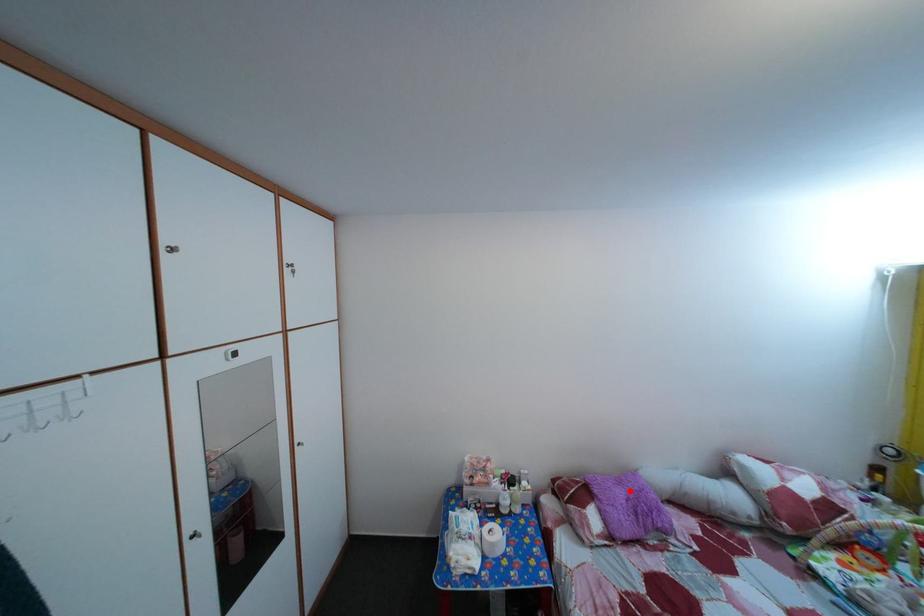
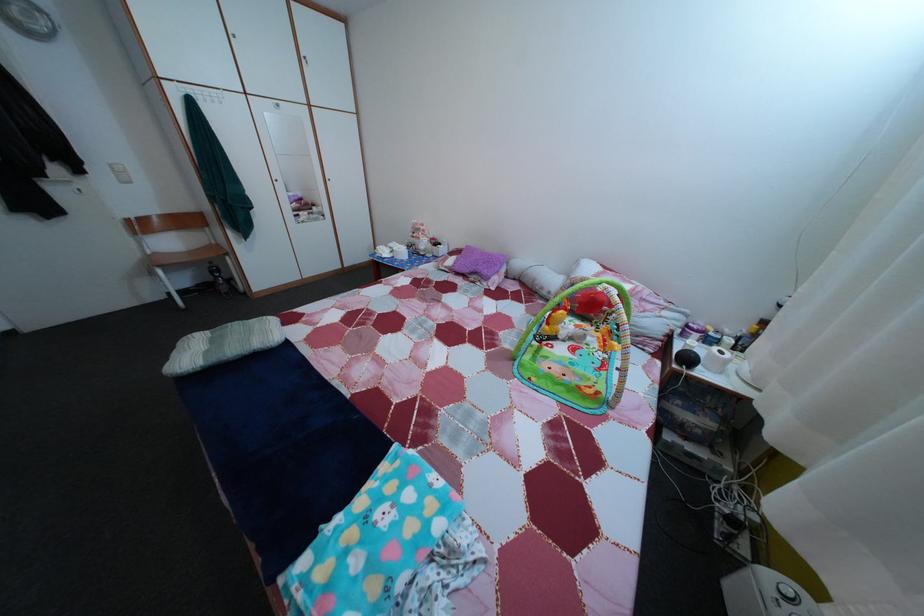
Question: I am providing you with two images of the same scene from different viewpoints. A red point is shown in image1. For the corresponding object point in image2, is it positioned nearer or farther from the camera?

Choices:
 (A) Nearer
 (B) Farther

Answer: (A)